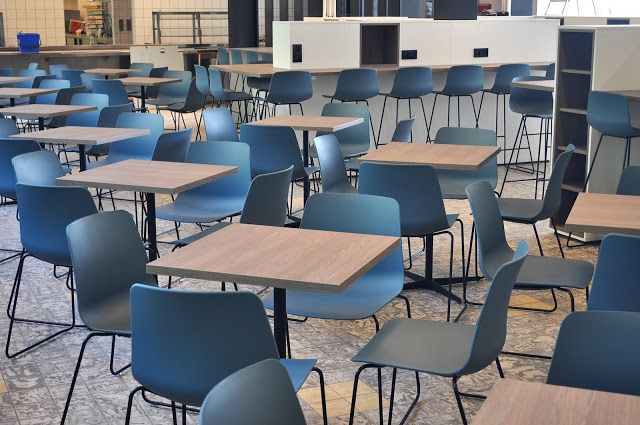
Identify the location of table legs. tap(276, 323), tap(147, 223), tap(83, 163), tap(38, 123), tap(12, 102), tap(428, 258), tap(305, 146).